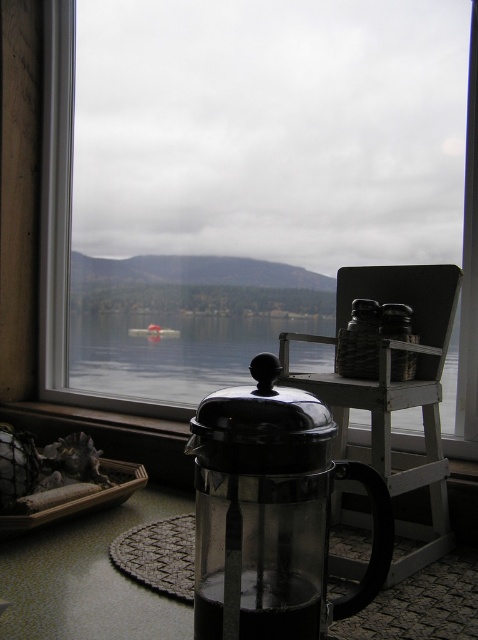
Question: Is transparent glass french press at center in front of wooden rocking chair at center?

Choices:
 (A) no
 (B) yes

Answer: (B)

Question: Estimate the real-world distances between objects in this image. Which object is closer to the wooden rocking chair at center?

Choices:
 (A) transparent glass french press at center
 (B) transparent glass window at center
 (C) transparent glass water at center

Answer: (C)

Question: Which point is closer to the camera?

Choices:
 (A) transparent glass french press at center
 (B) transparent glass window at center
 (C) wooden rocking chair at center

Answer: (A)

Question: Estimate the real-world distances between objects in this image. Which object is farther from the transparent glass window at center?

Choices:
 (A) transparent glass french press at center
 (B) wooden rocking chair at center
 (C) transparent glass water at center

Answer: (A)

Question: Does wooden rocking chair at center have a larger size compared to transparent glass window at center?

Choices:
 (A) yes
 (B) no

Answer: (B)

Question: Is wooden rocking chair at center to the right of transparent glass water at center from the viewer's perspective?

Choices:
 (A) no
 (B) yes

Answer: (B)